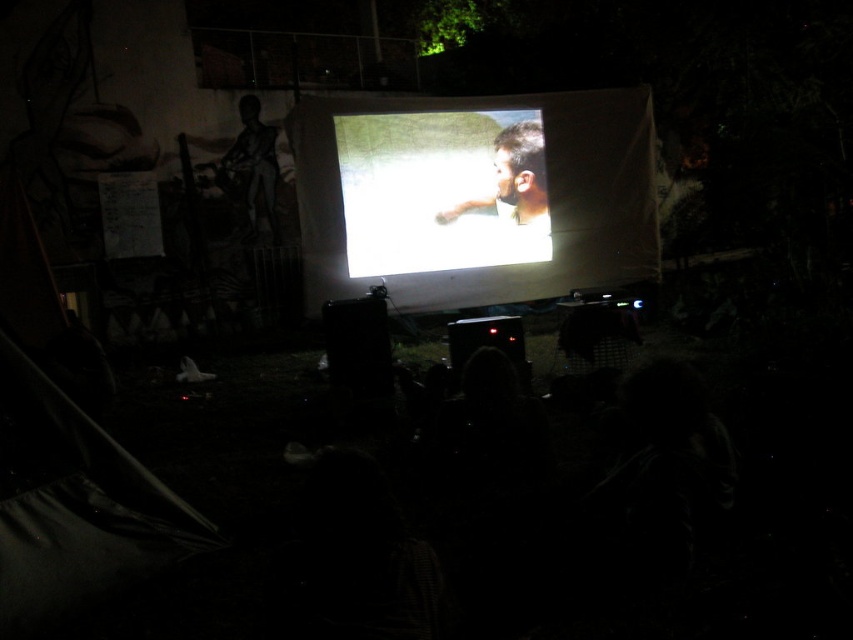
You are an event planner setting up chairs for an outdoor movie night. You notice the bright white screen at center and the smooth skin face at center in the image. Based on their positions, which object should you place higher to ensure the audience can see the movie clearly?

The bright white screen at center should be placed higher than the smooth skin face at center because the screen is currently located below the face, so raising the screen would allow the audience to view it properly.

You are standing in the outdoor movie night scene and want to walk from point A to point B. Point A is at coordinates point (532,173) and point B is at coordinates point (508,173). Which direction should you move to get from point A to point B?

You should move away from the screen because point 0.273, 0262 is closer to you than point (508,173).